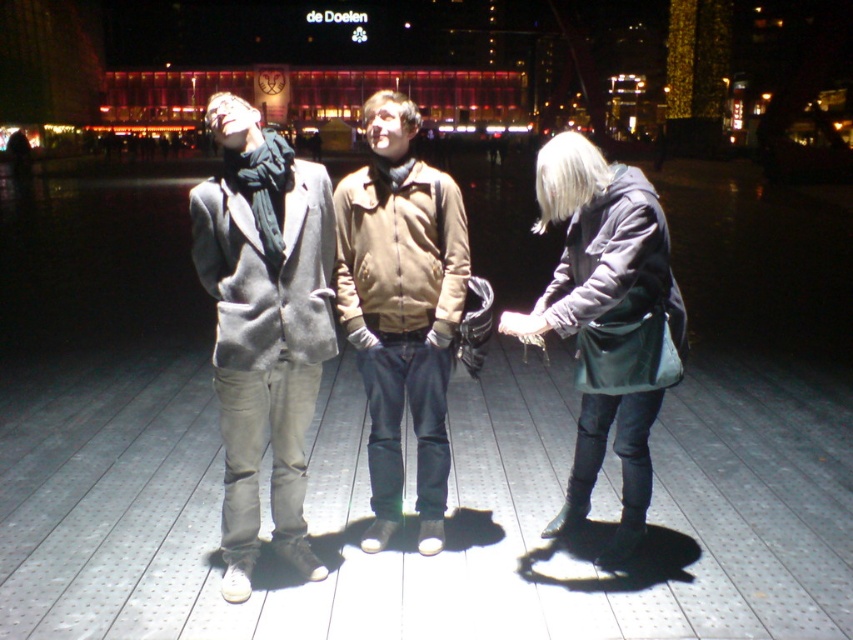
You are standing on the wooden deck and want to greet the person wearing the matte gray coat at center. Which direction should you move relative to the gray woolen coat at center?

The matte gray coat at center is to the right of the gray woolen coat at center, so you should move to the right side of the gray woolen coat at center to greet the person wearing the matte gray coat at center.

You are a fashion stylist trying to recommend outfits based on the image. Given that both the gray woolen coat at center and beige fabric jacket at center are available in the same store, which one would you suggest to a client who prefers a more voluminous look?

The gray woolen coat at center is larger in size than the beige fabric jacket at center, so it would be the better recommendation for a client seeking a voluminous look.

You are standing on the wooden deck and want to walk to a point closer to you. Which point should you go to, point (305, 333) or point (654, 218)?

Point (305, 333) is closer to you since it is further to the viewer compared to point (654, 218).